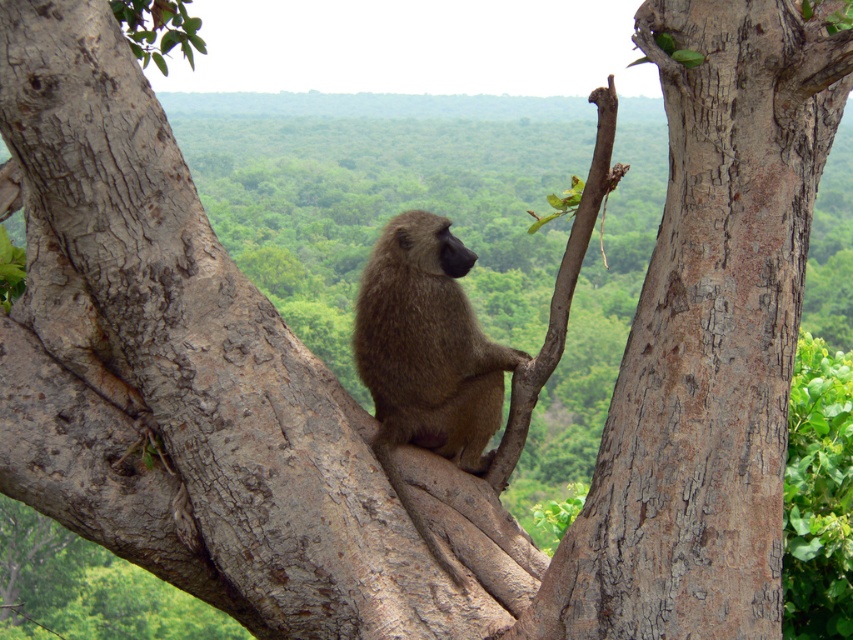
You are a photographer aiming to capture the fuzzy brown monkey at center and the brown rough bark at upper center in a single shot. Which object will appear closer to the camera lens?

The fuzzy brown monkey at center appears closer to the camera lens because it is further to the viewer than the brown rough bark at upper center.

You are a wildlife photographer aiming to capture a closeup of the gray rough bark tree trunk at center and the brown rough bark at upper center. Which one would you need to zoom in more on to get a detailed shot?

The brown rough bark at upper center requires more zooming in because it is smaller in size compared to the gray rough bark tree trunk at center.